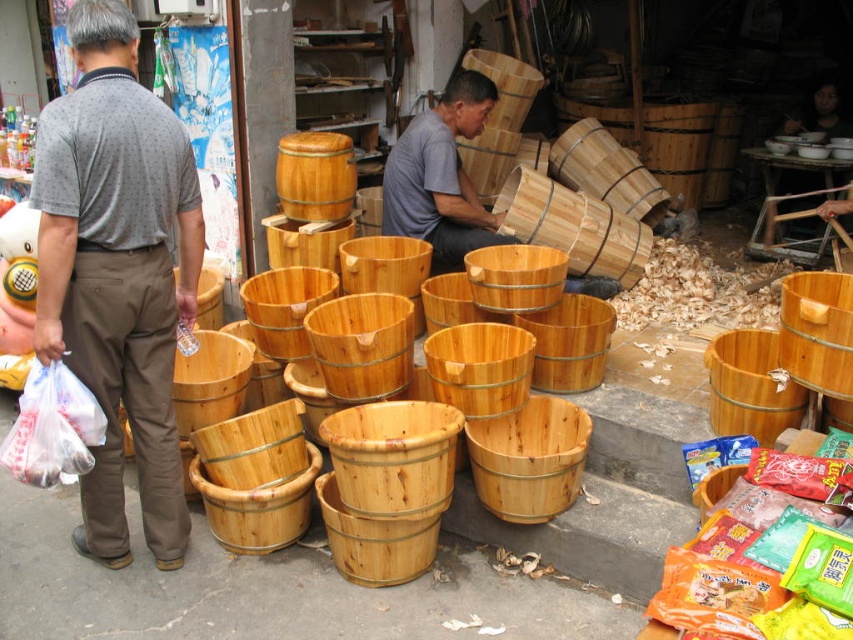
Between matte gray shirt at left and wooden bucket at center, which one appears on the left side from the viewer's perspective?

From the viewer's perspective, matte gray shirt at left appears more on the left side.

Does point (165, 170) lie in front of point (477, 209)?

Yes, point (165, 170) is closer to viewer.

At what (x,y) coordinates should I click in order to perform the action: click on matte gray shirt at left. Please return your answer as a coordinate pair (x, y). This screenshot has width=853, height=640. Looking at the image, I should click on (119, 273).

Locate an element on the screen. The image size is (853, 640). matte gray shirt at left is located at coordinates (119, 273).

Is matte gray shirt at left taller than natural wood bucket at center?

Yes, matte gray shirt at left is taller than natural wood bucket at center.

Between point (107, 420) and point (556, 230), which one is positioned in front?

Point (107, 420)

At what (x,y) coordinates should I click in order to perform the action: click on matte gray shirt at left. Please return your answer as a coordinate pair (x, y). Looking at the image, I should click on (119, 273).

Looking at this image, does natural wood bucket at center have a lesser height compared to wooden bucket at center?

No, natural wood bucket at center is not shorter than wooden bucket at center.

Is natural wood bucket at center to the left of wooden bucket at center from the viewer's perspective?

Yes, natural wood bucket at center is to the left of wooden bucket at center.

The height and width of the screenshot is (640, 853). What are the coordinates of `natural wood bucket at center` in the screenshot? It's located at (384, 266).

Find the location of a particular element. Image resolution: width=853 pixels, height=640 pixels. natural wood bucket at center is located at coordinates (384, 266).